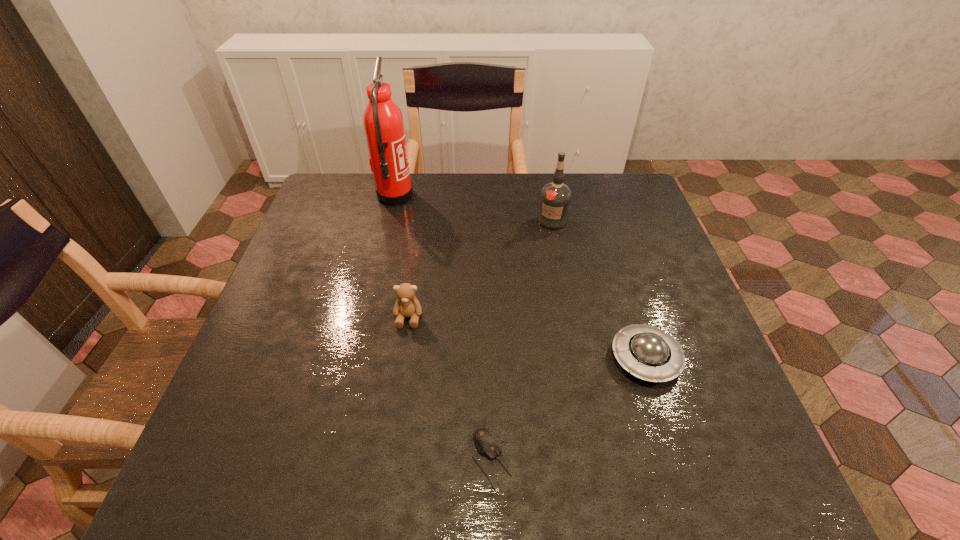
Locate an element on the screen. The image size is (960, 540). free space located 0.400m on the label side of the farthest object is located at coordinates (540, 196).

I want to click on vacant space situated on the front label of the fourth shortest object, so click(x=566, y=297).

Where is `free space located on the front-facing side of the third tallest object`? This screenshot has width=960, height=540. free space located on the front-facing side of the third tallest object is located at coordinates (385, 478).

I want to click on free point located on the left of the saucer, so click(463, 359).

What are the coordinates of `free space located on the left of the mouse` in the screenshot? It's located at point(368,460).

This screenshot has height=540, width=960. Identify the location of fire extinguisher at the far edge. (383, 121).

Where is `vodka present at the far edge`? The height and width of the screenshot is (540, 960). vodka present at the far edge is located at coordinates (555, 198).

Where is `object that is positioned at the near edge`? object that is positioned at the near edge is located at coordinates (486, 444).

Locate an element on the screen. object situated at the right edge is located at coordinates (647, 352).

The width and height of the screenshot is (960, 540). Identify the location of vacant area at the far edge of the desktop. (419, 203).